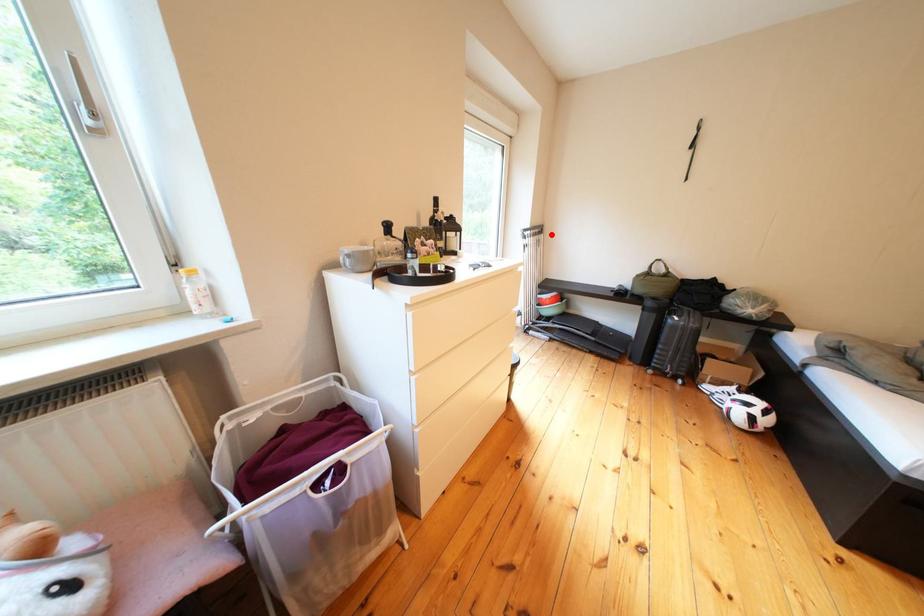
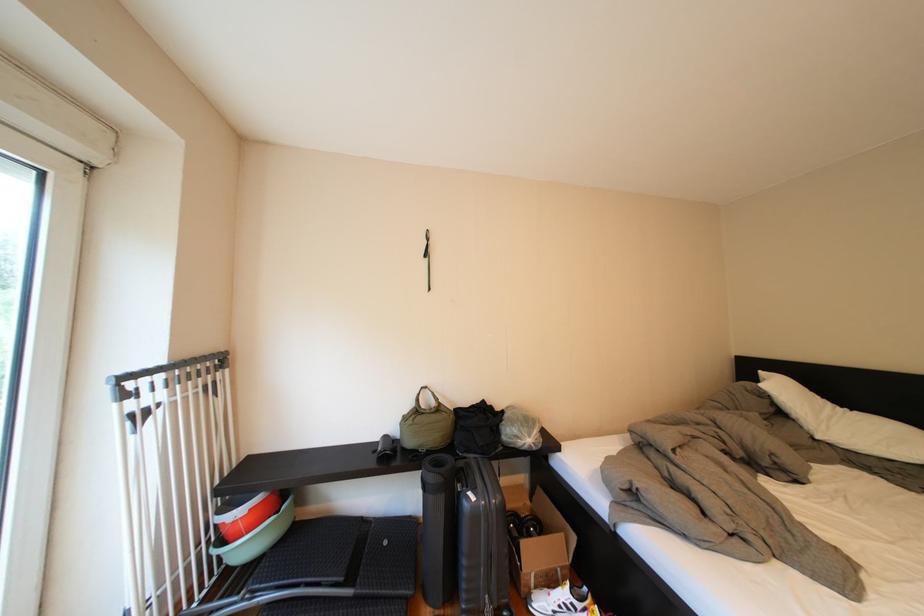
Question: A red point is marked in image1. In image2, is the corresponding 3D point closer to the camera or farther? Reply with the corresponding letter.

Choices:
 (A) The corresponding 3D point is closer.
 (B) The corresponding 3D point is farther.

Answer: (B)